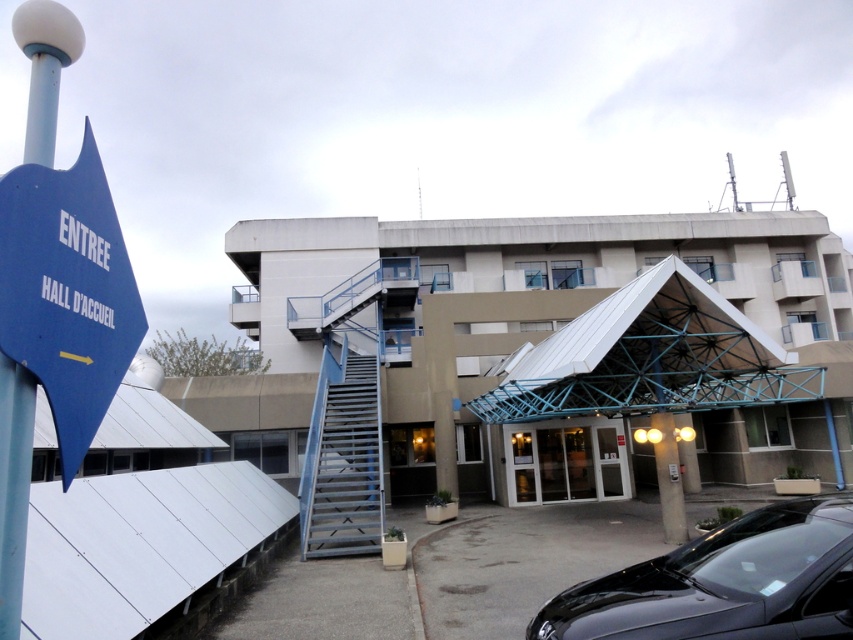
You are standing at the entrance of the building and want to reach the black glossy car at lower right. The blue plastic signpost at left has an arrow pointing towards the direction of the car. Is the signpost in front of or behind the car from your perspective?

The blue plastic signpost at left is behind the black glossy car at lower right, so from your perspective at the entrance, the signpost is behind the car.